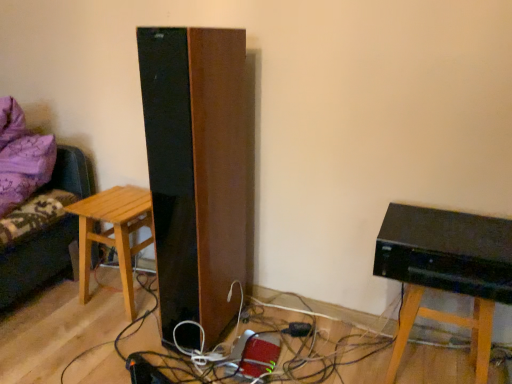
Find the location of a particular element. vacant area that lies between black glossy computer at lower right and black plastic plug at lower center is located at coordinates (345, 352).